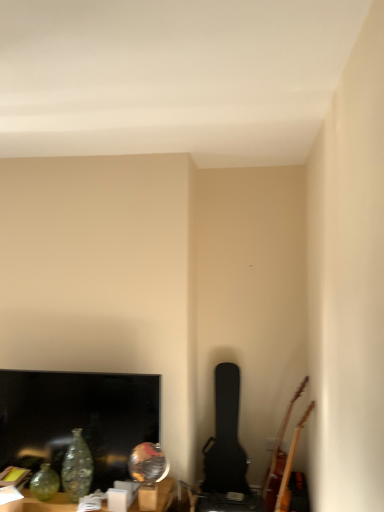
What do you see at coordinates (282, 435) in the screenshot? I see `wooden acoustic guitar at lower right, the second guitar from the left` at bounding box center [282, 435].

What do you see at coordinates (225, 438) in the screenshot?
I see `black textured guitar case at center-right, which is the 1th guitar from left to right` at bounding box center [225, 438].

What is the approximate width of matte black tv at lower left?

3.70 inches.

Image resolution: width=384 pixels, height=512 pixels. Find the location of `wooden acoustic guitar at lower right, the second guitar from the left`. wooden acoustic guitar at lower right, the second guitar from the left is located at coordinates pyautogui.click(x=282, y=435).

Which is behind, point (60, 493) or point (136, 398)?

The point (136, 398) is farther.

Between translucent glass vase at lower left and matte black tv at lower left, which one has larger width?

Wider between the two is translucent glass vase at lower left.

From the image's perspective, would you say translucent glass vase at lower left is shown under matte black tv at lower left?

Yes, from the image's perspective, translucent glass vase at lower left is beneath matte black tv at lower left.

From the image's perspective, which object appears higher, wooden acoustic guitar at lower right, arranged as the first guitar when viewed from the right, or matte black tv at lower left?

matte black tv at lower left, from the image's perspective.

Is wooden acoustic guitar at lower right, arranged as the first guitar when viewed from the right, far from matte black tv at lower left?

wooden acoustic guitar at lower right, arranged as the first guitar when viewed from the right, is positioned a significant distance from matte black tv at lower left.

From the image's perspective, starting from the matte black tv at lower left, which guitar is the 1st one below? Please provide its 2D coordinates.

[(282, 435)]

Does translucent glass vase at lower left lie in front of translucent glass vase at lower left?

No, it is behind translucent glass vase at lower left.

From a real-world perspective, which is physically below, translucent glass vase at lower left or translucent glass vase at lower left?

translucent glass vase at lower left, from a real-world perspective.

Does point (75, 469) come in front of point (173, 480)?

That is True.

From the image's perspective, is black textured guitar case at center-right, arranged as the second guitar when viewed from the right, on matte black tv at lower left?

No, from the image's perspective, black textured guitar case at center-right, arranged as the second guitar when viewed from the right, is not above matte black tv at lower left.

Is black textured guitar case at center-right, arranged as the second guitar when viewed from the right, thinner than matte black tv at lower left?

In fact, black textured guitar case at center-right, arranged as the second guitar when viewed from the right, might be wider than matte black tv at lower left.

Considering the positions of objects black textured guitar case at center-right, arranged as the second guitar when viewed from the right, and matte black tv at lower left in the image provided, who is more to the left, black textured guitar case at center-right, arranged as the second guitar when viewed from the right, or matte black tv at lower left?

From the viewer's perspective, matte black tv at lower left appears more on the left side.

Identify the location of television on the left of black textured guitar case at center-right, which is the 1th guitar from left to right. (77, 419).

How different are the orientations of matte black tv at lower left and translucent glass vase at lower left in degrees?

There is a 1.31-degree angle between the facing directions of matte black tv at lower left and translucent glass vase at lower left.

From a real-world perspective, is matte black tv at lower left positioned above or below translucent glass vase at lower left?

In terms of real-world spatial position, matte black tv at lower left is above translucent glass vase at lower left.

Which is in front, matte black tv at lower left or translucent glass vase at lower left?

translucent glass vase at lower left is in front.

From the image's perspective, is matte black tv at lower left under translucent glass vase at lower left?

No.

Is wooden acoustic guitar at lower right, the second guitar from the left, closer to the viewer compared to translucent glass vase at lower left?

No, wooden acoustic guitar at lower right, the second guitar from the left, is further to the viewer.

Can we say wooden acoustic guitar at lower right, arranged as the first guitar when viewed from the right, lies outside translucent glass vase at lower left?

Yes, wooden acoustic guitar at lower right, arranged as the first guitar when viewed from the right, is outside of translucent glass vase at lower left.

Could you measure the distance between wooden acoustic guitar at lower right, arranged as the first guitar when viewed from the right, and translucent glass vase at lower left?

wooden acoustic guitar at lower right, arranged as the first guitar when viewed from the right, and translucent glass vase at lower left are 36.65 inches apart.

From the image's perspective, which one is positioned higher, translucent glass vase at lower left or black textured guitar case at center-right, arranged as the second guitar when viewed from the right?

black textured guitar case at center-right, arranged as the second guitar when viewed from the right.

Considering the positions of point (52, 507) and point (224, 378), is point (52, 507) closer or farther from the camera than point (224, 378)?

Point (52, 507).

Are translucent glass vase at lower left and black textured guitar case at center-right, which is the 1th guitar from left to right, making contact?

translucent glass vase at lower left is not next to black textured guitar case at center-right, which is the 1th guitar from left to right, and they're not touching.

Is translucent glass vase at lower left facing towards black textured guitar case at center-right, arranged as the second guitar when viewed from the right?

No, translucent glass vase at lower left does not turn towards black textured guitar case at center-right, arranged as the second guitar when viewed from the right.

At what (x,y) coordinates should I click in order to perform the action: click on furniture in front of the matte black tv at lower left. Please return your answer as a coordinate pair (x, y). The height and width of the screenshot is (512, 384). Looking at the image, I should click on (47, 503).

From the matte black tv at lower left, count 1st guitars backward and point to it. Please provide its 2D coordinates.

[(282, 435)]

Considering their positions, is translucent glass vase at lower left positioned further to wooden acoustic guitar at lower right, the second guitar from the left, than translucent glass vase at lower left?

The object further to wooden acoustic guitar at lower right, the second guitar from the left, is translucent glass vase at lower left.

Looking at the image, which one is located closer to translucent glass vase at lower left, black textured guitar case at center-right, arranged as the second guitar when viewed from the right, or wooden acoustic guitar at lower right, the second guitar from the left?

The object closer to translucent glass vase at lower left is black textured guitar case at center-right, arranged as the second guitar when viewed from the right.

Estimate the real-world distances between objects in this image. Which object is further from translucent glass vase at lower left, wooden acoustic guitar at lower right, the second guitar from the left, or translucent glass vase at lower left?

wooden acoustic guitar at lower right, the second guitar from the left, is further to translucent glass vase at lower left.

Considering their positions, is translucent glass vase at lower left positioned further to translucent glass vase at lower left than black textured guitar case at center-right, arranged as the second guitar when viewed from the right?

black textured guitar case at center-right, arranged as the second guitar when viewed from the right.

Looking at the image, which one is located further to black textured guitar case at center-right, which is the 1th guitar from left to right, translucent glass vase at lower left or translucent glass vase at lower left?

translucent glass vase at lower left.

Considering their positions, is black textured guitar case at center-right, arranged as the second guitar when viewed from the right, positioned further to matte black tv at lower left than translucent glass vase at lower left?

Among the two, black textured guitar case at center-right, arranged as the second guitar when viewed from the right, is located further to matte black tv at lower left.

Looking at the image, which one is located closer to translucent glass vase at lower left, black textured guitar case at center-right, which is the 1th guitar from left to right, or translucent glass vase at lower left?

translucent glass vase at lower left.

Estimate the real-world distances between objects in this image. Which object is further from translucent glass vase at lower left, translucent glass vase at lower left or matte black tv at lower left?

Among the two, matte black tv at lower left is located further to translucent glass vase at lower left.

You are a GUI agent. You are given a task and a screenshot of the screen. Output one action in this format:
    pyautogui.click(x=<x>, y=<y>)
    Task: Click on the television located between translucent glass vase at lower left and black textured guitar case at center-right, arranged as the second guitar when viewed from the right, in the left-right direction
    This screenshot has width=384, height=512.
    Given the screenshot: What is the action you would take?
    pyautogui.click(x=77, y=419)

Find the location of a particular element. This screenshot has width=384, height=512. guitar between translucent glass vase at lower left and wooden acoustic guitar at lower right, arranged as the first guitar when viewed from the right, in the horizontal direction is located at coordinates (225, 438).

Identify the location of glass vase between translucent glass vase at lower left and wooden acoustic guitar at lower right, arranged as the first guitar when viewed from the right. Image resolution: width=384 pixels, height=512 pixels. (77, 467).

You are a GUI agent. You are given a task and a screenshot of the screen. Output one action in this format:
    pyautogui.click(x=<x>, y=<y>)
    Task: Click on the guitar located between translucent glass vase at lower left and wooden acoustic guitar at lower right, the second guitar from the left, in the left-right direction
    This screenshot has width=384, height=512.
    Given the screenshot: What is the action you would take?
    pyautogui.click(x=225, y=438)